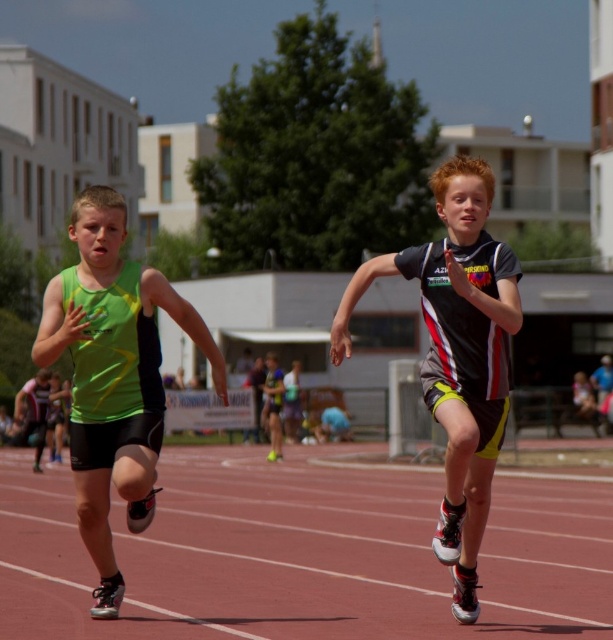
Question: Is rubberized red track at center bigger than green matte tank top at left?

Choices:
 (A) no
 (B) yes

Answer: (B)

Question: Can you confirm if rubberized red track at center is thinner than green matte tank top at left?

Choices:
 (A) no
 (B) yes

Answer: (A)

Question: Considering the real-world distances, which object is farthest from the black and white jersey at center?

Choices:
 (A) green matte tank top at left
 (B) rubberized red track at center

Answer: (B)

Question: Among these points, which one is nearest to the camera?

Choices:
 (A) (70, 584)
 (B) (476, 381)

Answer: (B)

Question: Estimate the real-world distances between objects in this image. Which object is farther from the green matte tank top at left?

Choices:
 (A) black and white jersey at center
 (B) rubberized red track at center

Answer: (B)

Question: Can you confirm if rubberized red track at center is positioned above green matte tank top at left?

Choices:
 (A) no
 (B) yes

Answer: (A)